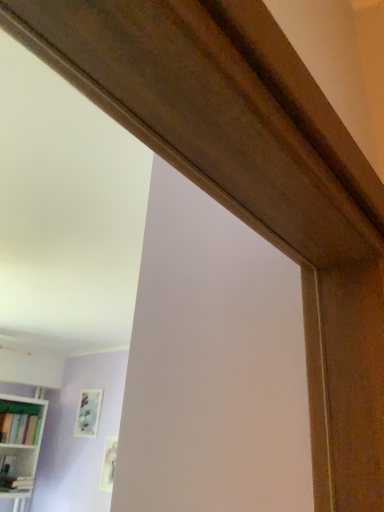
Question: Is white glossy bookcase at lower left situated inside matte green bookshelf at lower left or outside?

Choices:
 (A) outside
 (B) inside

Answer: (A)

Question: Is point (0, 443) closer or farther from the camera than point (13, 415)?

Choices:
 (A) closer
 (B) farther

Answer: (A)

Question: Which is farther from the matte white picture frame at lower center, which is the second picture frame from back to front?

Choices:
 (A) matte green bookshelf at lower left
 (B) matte wooden picture frame at upper left, acting as the 2th picture frame starting from the right
 (C) white glossy bookcase at lower left

Answer: (A)

Question: Which is farther from the white glossy bookcase at lower left?

Choices:
 (A) matte white picture frame at lower center, which ranks as the first picture frame in front-to-back order
 (B) matte wooden picture frame at upper left, the 1th picture frame viewed from the left
 (C) matte green bookshelf at lower left

Answer: (A)